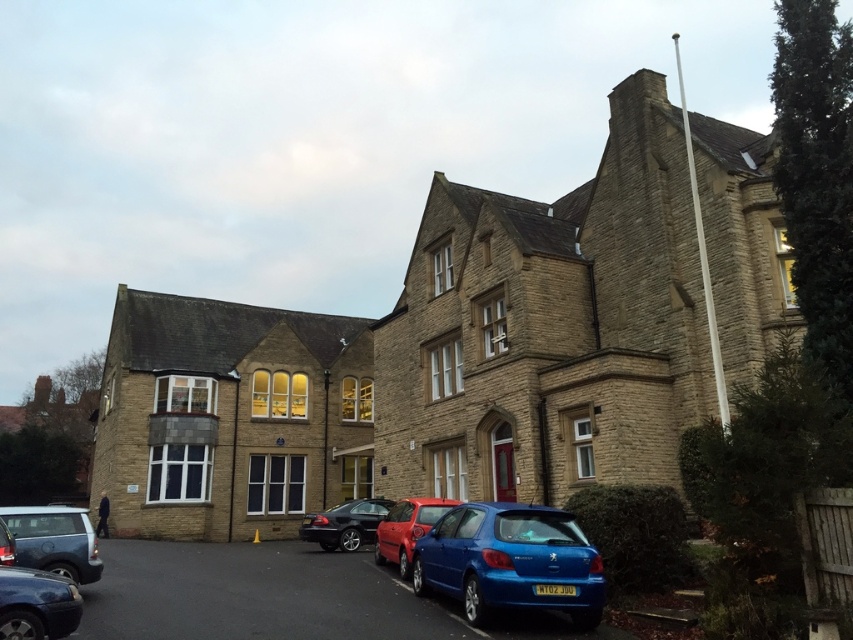
Question: Is matte silver suv at lower left to the right of metallic silver car at lower left from the viewer's perspective?

Choices:
 (A) yes
 (B) no

Answer: (B)

Question: Which point appears farthest from the camera in this image?

Choices:
 (A) (350, 540)
 (B) (3, 536)
 (C) (28, 637)
 (D) (42, 566)

Answer: (A)

Question: Among these objects, which one is nearest to the camera?

Choices:
 (A) matte blue hatchback at lower right
 (B) matte silver suv at lower left

Answer: (A)

Question: Among these objects, which one is nearest to the camera?

Choices:
 (A) metallic silver car at lower left
 (B) matte blue hatchback at lower right

Answer: (B)

Question: Is matte blue hatchback at lower right closer to the viewer compared to matte silver suv at lower left?

Choices:
 (A) yes
 (B) no

Answer: (A)

Question: Can you confirm if satin black car at lower center is smaller than matte red car at center?

Choices:
 (A) yes
 (B) no

Answer: (B)